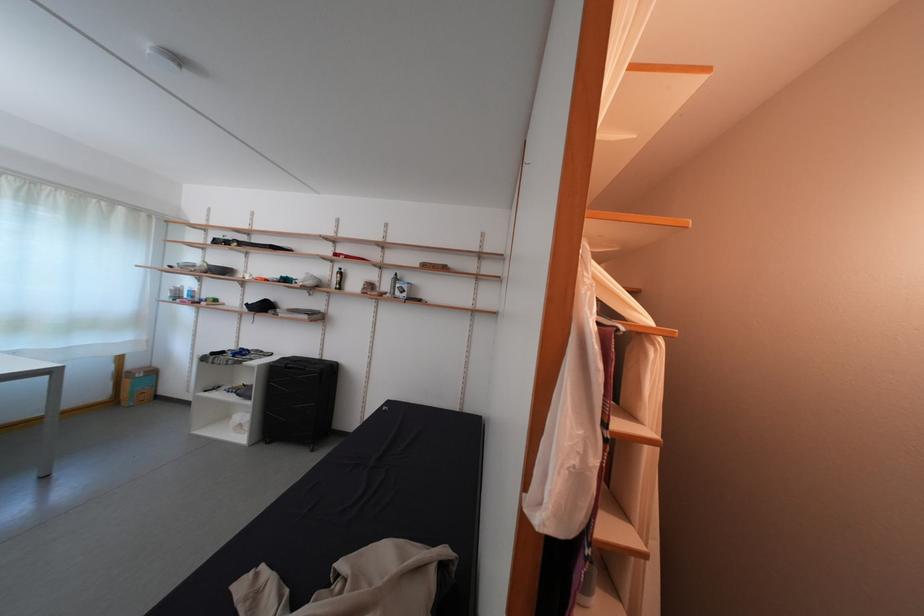
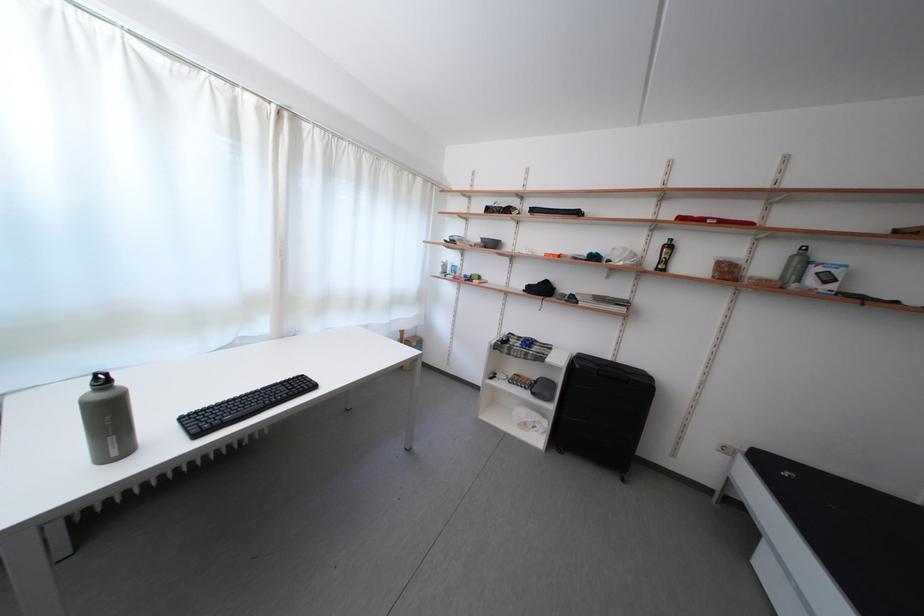
The point at (346, 275) is marked in the first image. Where is the corresponding point in the second image?

(669, 246)